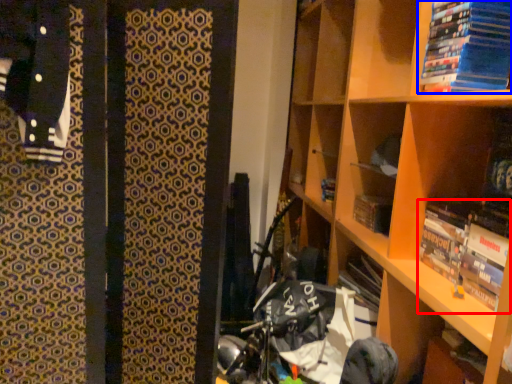
Question: Which point is further to the camera, book (highlighted by a red box) or book (highlighted by a blue box)?

Choices:
 (A) book
 (B) book

Answer: (A)